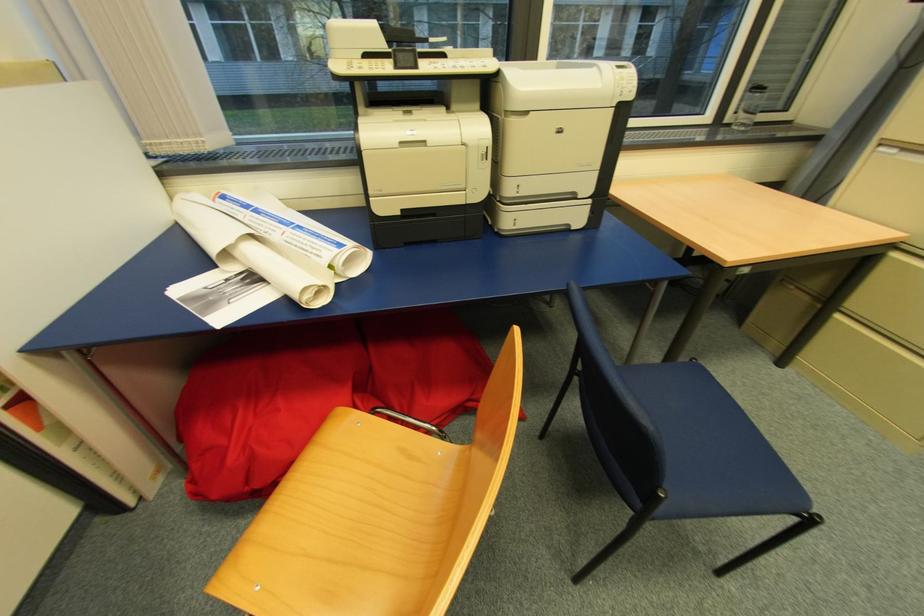
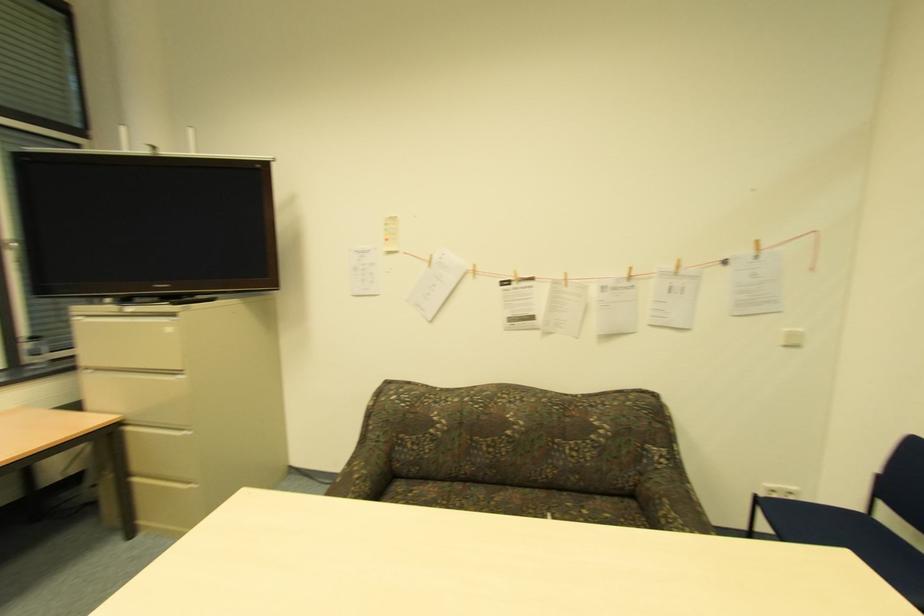
In the second image, find the point that corresponds to (x=881, y=148) in the first image.

(91, 370)